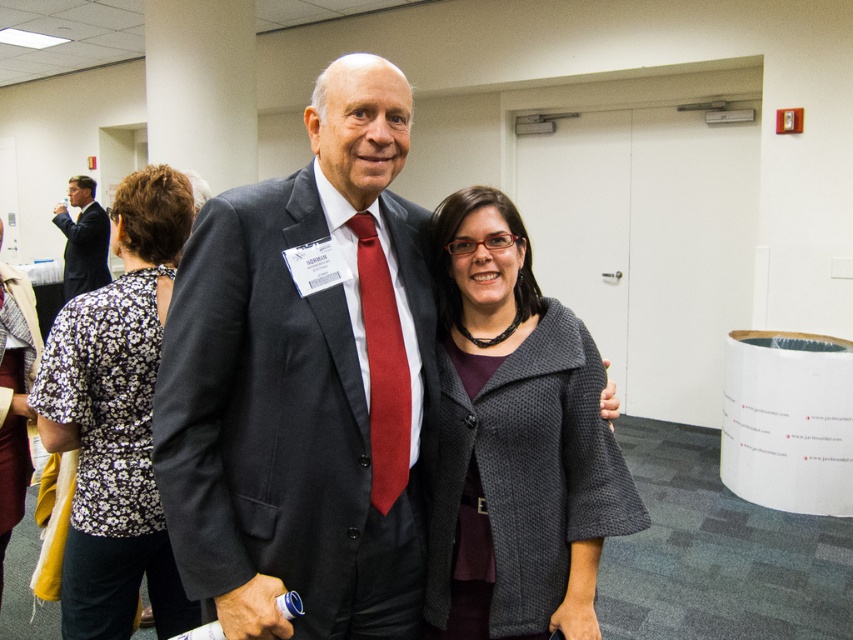
Consider the image. Where is the matte black suit at center located in the image?

The matte black suit at center is located at point (x=300, y=387) in the image.